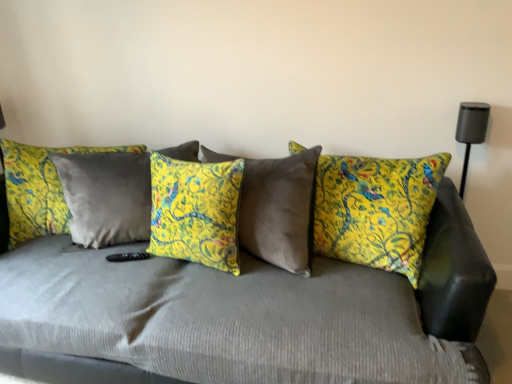
Question: Is yellow floral pillow at center, placed as the third pillow when sorted from right to left, inside or outside of yellow floral cushion at center, placed as the first pillow when sorted from right to left?

Choices:
 (A) inside
 (B) outside

Answer: (B)

Question: From a real-world perspective, is yellow floral pillow at center, which is counted as the first pillow, starting from the left, positioned above or below yellow floral cushion at center, positioned as the 3th pillow in left-to-right order?

Choices:
 (A) above
 (B) below

Answer: (B)

Question: Estimate the real-world distances between objects in this image. Which object is farther from the yellow floral pillow at center, placed as the third pillow when sorted from right to left?

Choices:
 (A) velvet gray couch at center
 (B) yellow fabric pillow at center, the second pillow viewed from the left
 (C) yellow floral cushion at center, positioned as the 3th pillow in left-to-right order

Answer: (C)

Question: Which object is positioned farthest from the yellow floral pillow at center, which is counted as the first pillow, starting from the left?

Choices:
 (A) yellow floral cushion at center, positioned as the 3th pillow in left-to-right order
 (B) velvet gray couch at center
 (C) yellow fabric pillow at center, the second pillow viewed from the left

Answer: (A)